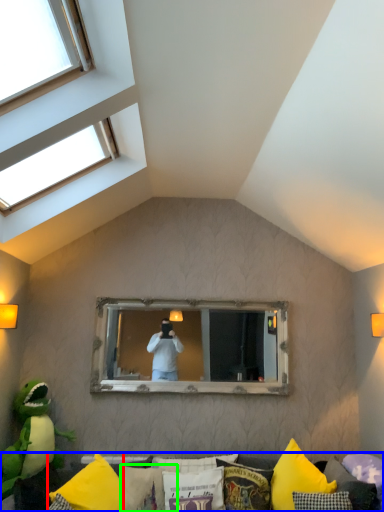
Question: Based on their relative distances, which object is nearer to pillow (highlighted by a red box)? Choose from furniture (highlighted by a blue box) and pillow (highlighted by a green box).

Choices:
 (A) furniture
 (B) pillow

Answer: (B)